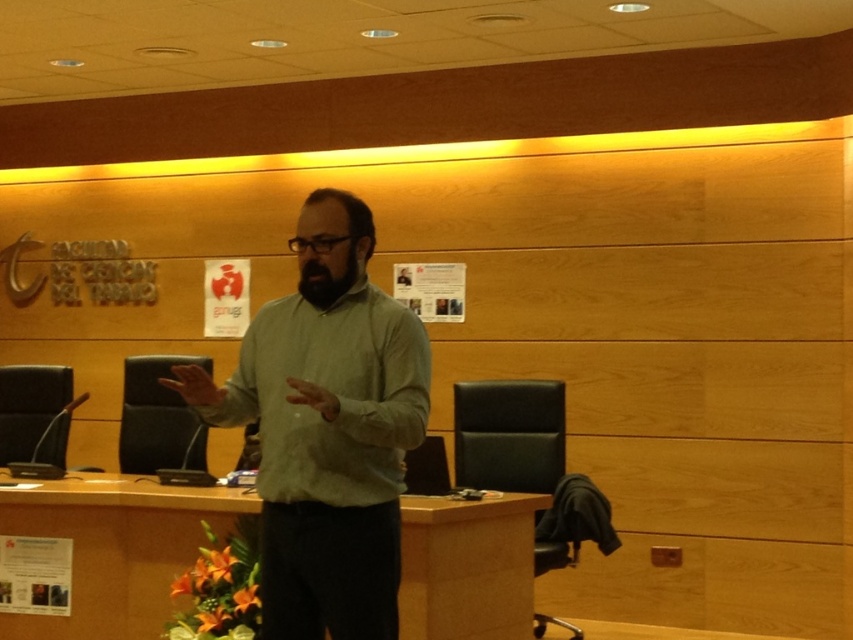
You are standing in the conference room and want to place a small plant on the desk. The desk is located at point (x=328, y=435). The green matte shirt at center is currently there. Can you place the plant there without moving the green matte shirt at center?

The green matte shirt at center is located at point (x=328, y=435), so placing the plant there would require moving the green matte shirt at center to make space.

You are an attendee at a university lecture and see the speaker wearing a green matte shirt at center and a black fuzzy beard at center. Which part of the speaker is higher up on his body?

The green matte shirt at center is taller than black fuzzy beard at center, so the shirt is higher up on the speaker.

You are an attendee at the presentation and want to describe the speaker. Which object is positioned to the left of the other between the green matte dress shirt at center and the black fuzzy beard at center?

The green matte dress shirt at center is positioned to the left of the black fuzzy beard at center.